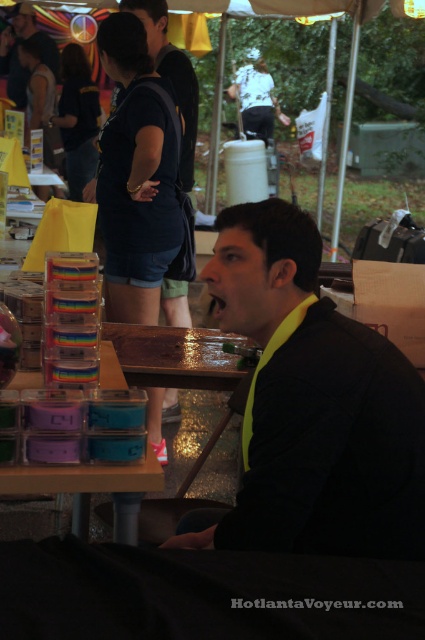
Question: Is the position of black matte jacket at center less distant than that of matte plastic containers at lower center?

Choices:
 (A) yes
 (B) no

Answer: (A)

Question: Which point is farther from the camera taking this photo?

Choices:
 (A) coord(248,512)
 (B) coord(127,500)

Answer: (B)

Question: Which point is closer to the camera?

Choices:
 (A) (130, 476)
 (B) (323, 513)

Answer: (B)

Question: Is black matte jacket at center bigger than matte plastic containers at lower center?

Choices:
 (A) no
 (B) yes

Answer: (B)

Question: Is black matte jacket at center positioned at the back of matte plastic containers at lower center?

Choices:
 (A) yes
 (B) no

Answer: (B)

Question: Which of the following is the closest to the observer?

Choices:
 (A) (155, 477)
 (B) (289, 232)

Answer: (A)